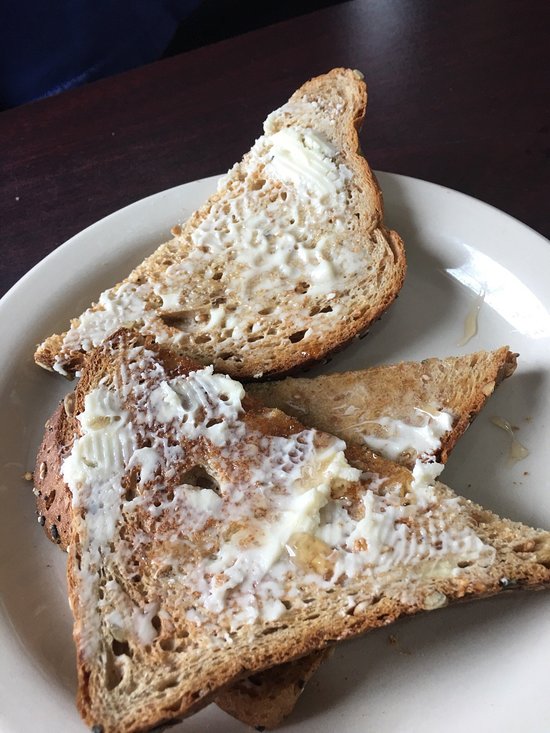
I want to click on white plate, so click(417, 302).